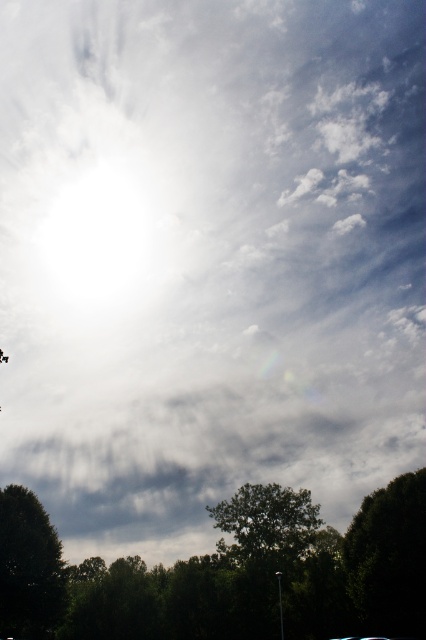
You are standing at the camera position and want to walk towards the dark green leafy tree at lower right. Approximately how far will you have to walk to reach it?

The dark green leafy tree at lower right is 47.79 meters away from the camera, so you will need to walk approximately 47.79 meters to reach it.

You are standing in a field looking at the sky scene described. There is a point at coordinates point (351, 596) that you want to reach. Can you walk directly to it from your current position?

The distance of point (351, 596) from camera is 172.78 feet, so you can walk directly to it as it is within a reachable distance.

You are standing at the base of the dark green leafy tree at lower right and want to walk to the green matte tree at lower left. How far will you have to walk?

The dark green leafy tree at lower right is 26.60 meters away from the green matte tree at lower left, so you will have to walk 26.60 meters to reach it.